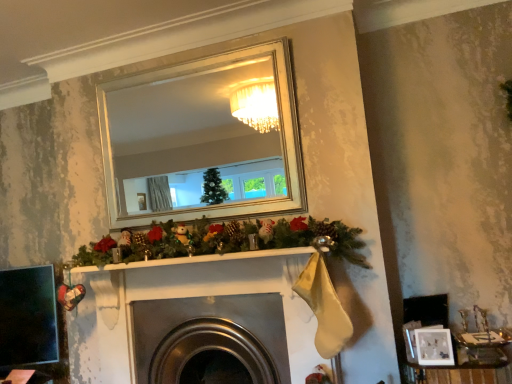
What do you see at coordinates (458, 374) in the screenshot? I see `metallic silver jewelry box at lower right` at bounding box center [458, 374].

The width and height of the screenshot is (512, 384). In order to click on white matte picture frame at lower right in this screenshot , I will do `click(434, 346)`.

Is point (144, 367) more distant than point (433, 360)?

That is True.

From a real-world perspective, is metallic silver fireplace at center under white matte picture frame at lower right?

No, from a real-world perspective, metallic silver fireplace at center is not under white matte picture frame at lower right.

Between metallic silver fireplace at center and white matte picture frame at lower right, which one has less height?

With less height is white matte picture frame at lower right.

From the image's perspective, is metallic silver fireplace at center positioned above or below white matte picture frame at lower right?

metallic silver fireplace at center is below white matte picture frame at lower right.

Who is bigger, metallic silver jewelry box at lower right or white matte picture frame at lower right?

metallic silver jewelry box at lower right is bigger.

Is point (402, 368) closer or farther from the camera than point (446, 352)?

Point (402, 368) is farther from the camera than point (446, 352).

Is metallic silver jewelry box at lower right not near white matte picture frame at lower right?

They are positioned close to each other.

Is white matte picture frame at lower right not inside metallic silver jewelry box at lower right?

Yes, white matte picture frame at lower right is not within metallic silver jewelry box at lower right.

What's the angular difference between white matte picture frame at lower right and metallic silver jewelry box at lower right's facing directions?

The angle between the facing direction of white matte picture frame at lower right and the facing direction of metallic silver jewelry box at lower right is 1.75 degrees.

In the scene shown: Measure the distance between white matte picture frame at lower right and metallic silver jewelry box at lower right.

white matte picture frame at lower right and metallic silver jewelry box at lower right are 5.88 inches apart from each other.

From a real-world perspective, is white matte picture frame at lower right positioned over metallic silver jewelry box at lower right based on gravity?

Yes, from a real-world perspective, white matte picture frame at lower right is on top of metallic silver jewelry box at lower right.

Consider the image. Is white matte picture frame at lower right taller than metallic silver fireplace at center?

No, white matte picture frame at lower right is not taller than metallic silver fireplace at center.

Is the position of white matte picture frame at lower right less distant than that of metallic silver fireplace at center?

Yes, white matte picture frame at lower right is closer to the camera.

How different are the orientations of white matte picture frame at lower right and metallic silver fireplace at center in degrees?

1.45 degrees separate the facing orientations of white matte picture frame at lower right and metallic silver fireplace at center.

Does white matte picture frame at lower right turn towards metallic silver fireplace at center?

No, white matte picture frame at lower right is not aimed at metallic silver fireplace at center.

Who is taller, metallic silver fireplace at center or metallic silver jewelry box at lower right?

metallic silver fireplace at center.

From a real-world perspective, is metallic silver fireplace at center physically located above or below metallic silver jewelry box at lower right?

Clearly, from a real-world perspective, metallic silver fireplace at center is above metallic silver jewelry box at lower right.

How distant is metallic silver fireplace at center from metallic silver jewelry box at lower right?

metallic silver fireplace at center is 99.26 centimeters from metallic silver jewelry box at lower right.

Which is behind, point (492, 374) or point (285, 341)?

The point (285, 341) is behind.

From the image's perspective, is metallic silver jewelry box at lower right located above metallic silver fireplace at center?

No.

Based on the photo, from a real-world perspective, is metallic silver jewelry box at lower right over metallic silver fireplace at center?

Actually, metallic silver jewelry box at lower right is physically below metallic silver fireplace at center in the real world.

How different are the orientations of metallic silver jewelry box at lower right and metallic silver fireplace at center in degrees?

They differ by 0.293 degrees in their facing directions.

You are a GUI agent. You are given a task and a screenshot of the screen. Output one action in this format:
    pyautogui.click(x=<x>, y=<y>)
    Task: Click on the fireplace that appears above the white matte picture frame at lower right (from a real-world perspective)
    This screenshot has height=384, width=512.
    Given the screenshot: What is the action you would take?
    pyautogui.click(x=210, y=335)

Image resolution: width=512 pixels, height=384 pixels. Identify the location of furniture that is below the white matte picture frame at lower right (from the image's perspective). (458, 374).

Considering their positions, is metallic silver fireplace at center positioned further to white matte picture frame at lower right than metallic silver jewelry box at lower right?

The object further to white matte picture frame at lower right is metallic silver fireplace at center.

When comparing their distances from metallic silver fireplace at center, does metallic silver jewelry box at lower right or white matte picture frame at lower right seem further?

white matte picture frame at lower right is further to metallic silver fireplace at center.

Estimate the real-world distances between objects in this image. Which object is further from white matte picture frame at lower right, metallic silver jewelry box at lower right or metallic silver fireplace at center?

metallic silver fireplace at center lies further to white matte picture frame at lower right than the other object.

Based on their spatial positions, is white matte picture frame at lower right or metallic silver fireplace at center further from metallic silver jewelry box at lower right?

The object further to metallic silver jewelry box at lower right is metallic silver fireplace at center.

When comparing their distances from metallic silver fireplace at center, does white matte picture frame at lower right or metallic silver jewelry box at lower right seem closer?

metallic silver jewelry box at lower right lies closer to metallic silver fireplace at center than the other object.

From the image, which object appears to be nearer to metallic silver jewelry box at lower right, metallic silver fireplace at center or white matte picture frame at lower right?

white matte picture frame at lower right is closer to metallic silver jewelry box at lower right.

What are the coordinates of `picture frame located between metallic silver fireplace at center and metallic silver jewelry box at lower right in the left-right direction` in the screenshot? It's located at (434, 346).